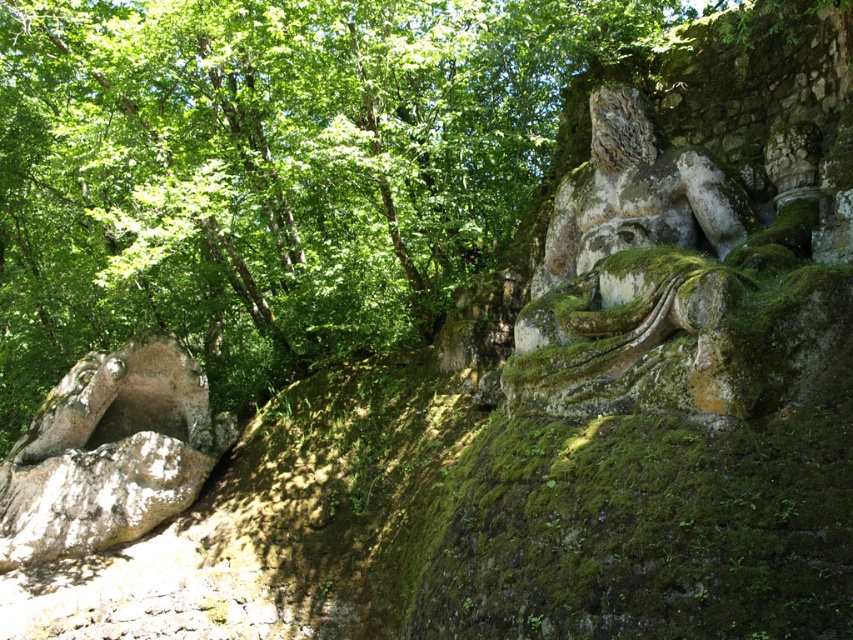
Question: In this image, where is rough textured rock at left located relative to green mossy stone statue at upper right?

Choices:
 (A) below
 (B) above

Answer: (A)

Question: Which point is farther from the camera taking this photo?

Choices:
 (A) (619, 88)
 (B) (155, 385)
 (C) (705, 360)

Answer: (B)

Question: Is rough textured rock at left below green mossy stone statue at upper right?

Choices:
 (A) yes
 (B) no

Answer: (A)

Question: Which object appears farthest from the camera in this image?

Choices:
 (A) green mossy stone reclining figure at right
 (B) green mossy stone statue at upper right
 (C) rough textured rock at left

Answer: (C)

Question: Which of these objects is positioned closest to the green mossy stone reclining figure at right?

Choices:
 (A) rough textured rock at left
 (B) green mossy stone statue at upper right

Answer: (B)

Question: Does rough textured rock at left appear under green mossy stone statue at upper right?

Choices:
 (A) no
 (B) yes

Answer: (B)